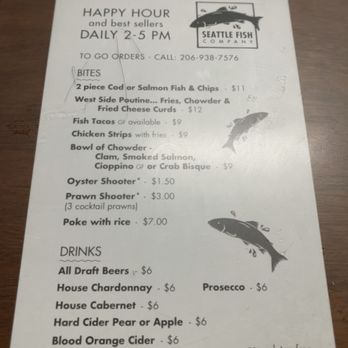
At what (x,y) coordinates should I click in order to perform the action: click on black wood table, background. Please return your answer as a coordinate pair (x, y). The width and height of the screenshot is (348, 348). Looking at the image, I should click on (14, 25).